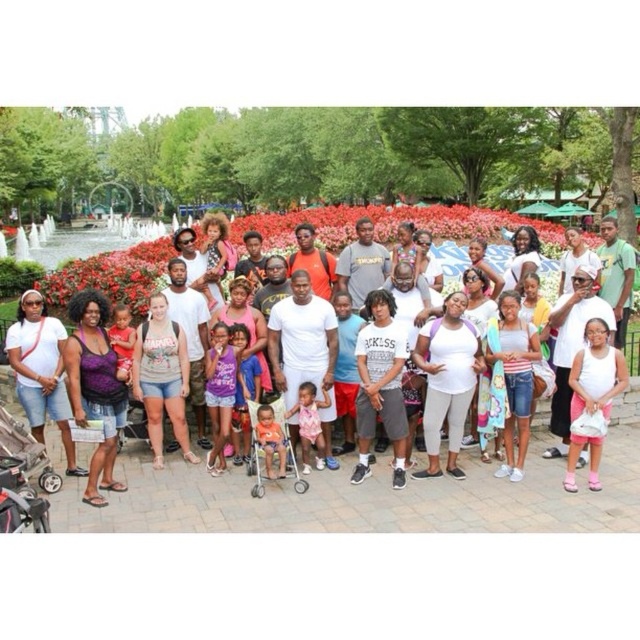
Can you confirm if white matte shirt at center is wider than green cotton shirt at center?

In fact, white matte shirt at center might be narrower than green cotton shirt at center.

Is white matte shirt at center shorter than green cotton shirt at center?

In fact, white matte shirt at center may be taller than green cotton shirt at center.

Does point (276, 301) lie behind point (620, 282)?

No, (276, 301) is in front of (620, 282).

I want to click on white matte shirt at center, so click(x=305, y=348).

Is silver metallic stroller at center smaller than green cotton shirt at center?

Yes.

Is silver metallic stroller at center below green cotton shirt at center?

Indeed, silver metallic stroller at center is positioned under green cotton shirt at center.

The image size is (640, 640). I want to click on silver metallic stroller at center, so click(x=272, y=445).

Between black plastic baby carriage at lower left and green cotton shirt at center, which one has less height?

Standing shorter between the two is black plastic baby carriage at lower left.

Can you confirm if black plastic baby carriage at lower left is taller than green cotton shirt at center?

No, black plastic baby carriage at lower left is not taller than green cotton shirt at center.

Which is in front, point (10, 467) or point (618, 244)?

Positioned in front is point (10, 467).

Identify the location of black plastic baby carriage at lower left. The height and width of the screenshot is (640, 640). (22, 477).